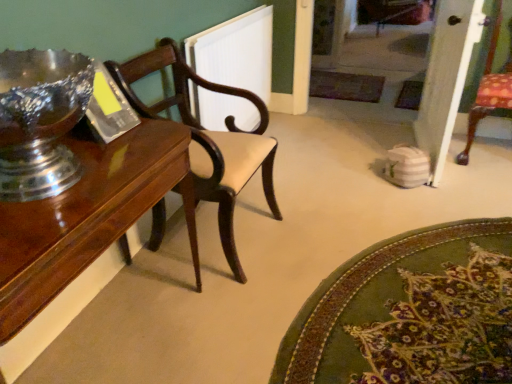
The image size is (512, 384). Find the location of `vacant area to the right of mahogany wood chair at left`. vacant area to the right of mahogany wood chair at left is located at coordinates (295, 229).